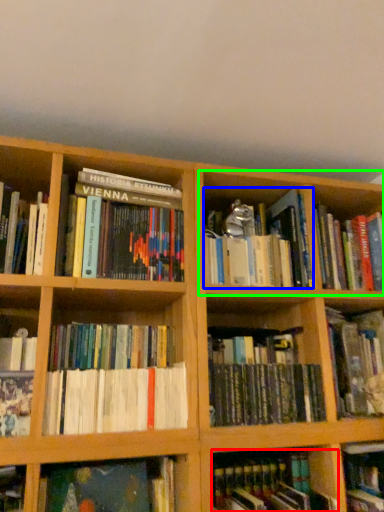
Question: Considering the real-world distances, which object is farthest from book (highlighted by a red box)? book (highlighted by a blue box) or cabinet (highlighted by a green box)?

Choices:
 (A) book
 (B) cabinet

Answer: (B)